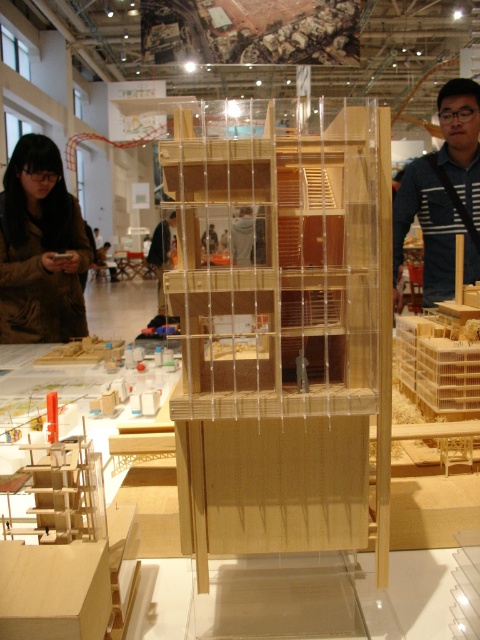
Can you confirm if blue striped shirt at upper right is positioned to the right of wooden figure at center?

Correct, you'll find blue striped shirt at upper right to the right of wooden figure at center.

Between blue striped shirt at upper right and wooden figure at center, which one is positioned higher?

wooden figure at center

Where is `blue striped shirt at upper right`? blue striped shirt at upper right is located at coordinates (444, 195).

Is brown leather jacket at lower left shorter than blue striped shirt at upper right?

Correct, brown leather jacket at lower left is not as tall as blue striped shirt at upper right.

At what (x,y) coordinates should I click in order to perform the action: click on brown leather jacket at lower left. Please return your answer as a coordinate pair (x, y). Looking at the image, I should click on tap(39, 248).

Is wooden cage at center below brown leather jacket at lower left?

Yes.

Which is behind, point (196, 312) or point (9, 310)?

The point (9, 310) is more distant.

At what (x,y) coordinates should I click in order to perform the action: click on wooden cage at center. Please return your answer as a coordinate pair (x, y). Image resolution: width=480 pixels, height=640 pixels. Looking at the image, I should click on (280, 324).